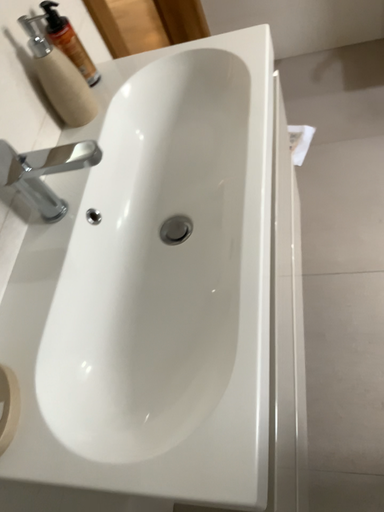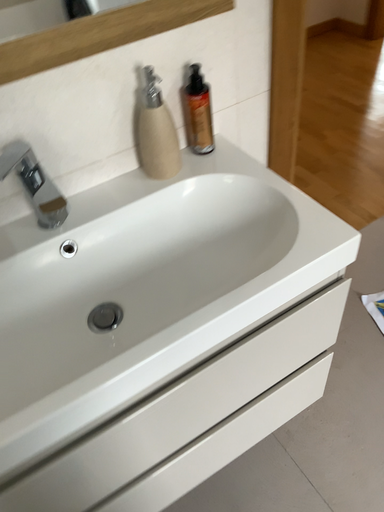
Question: How did the camera likely rotate when shooting the video?

Choices:
 (A) rotated right
 (B) rotated left

Answer: (B)